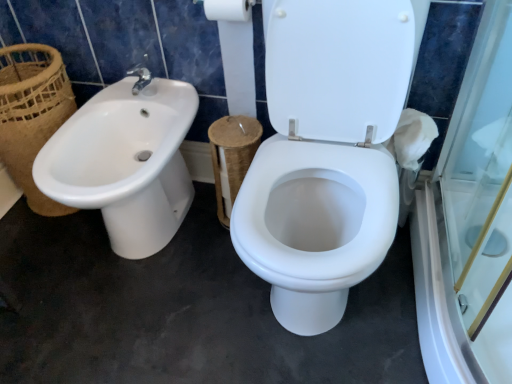
In order to click on free space between white glossy sink at left and brown woven basket at left in this screenshot , I will do `click(57, 236)`.